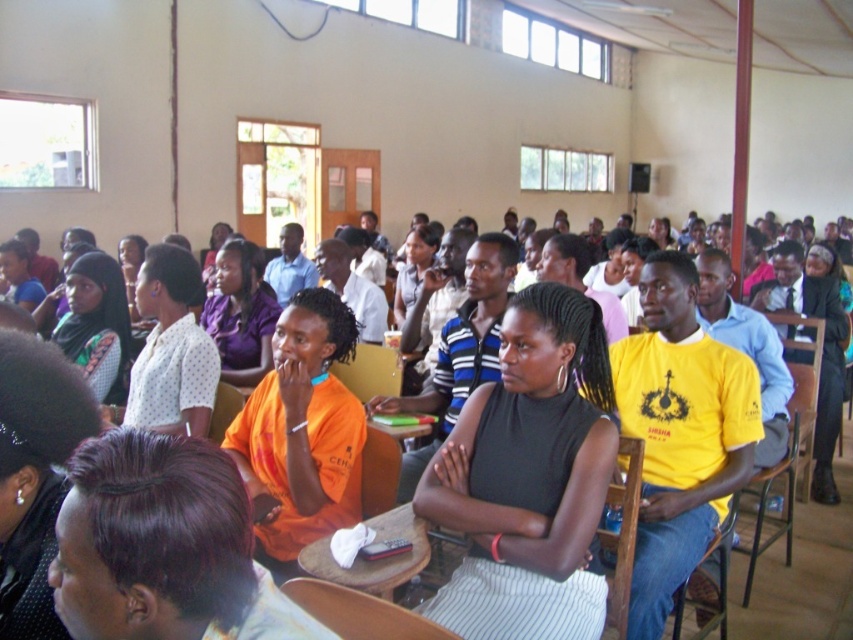
You are sitting in a classroom and want to look at the person with dark purple hair at center without moving your head. Which direction should you turn your head to see them relative to the wooden chair at lower right?

You should turn your head to the left side relative to the wooden chair at lower right because the dark purple hair at center is positioned on the left side of it.

You are a photographer standing at the front of the room. You want to take a closeup photo of the dark purple hair at center. The camera you are using has a minimum focusing distance of 36 inches. Will you be able to take the photo without moving closer?

The dark purple hair at center is 35.40 inches away from camera. Since the minimum focusing distance is 36 inches, the camera cannot focus on the subject from this distance. You need to move back to increase the distance between the camera and the subject to at least 36 inches to take the photo.

You are a photographer in the room and want to take a photo of the dark purple hair at center and the matte black hijab at center. Which object is located lower in the image?

The dark purple hair at center is positioned under the matte black hijab at center, so it is lower in the image.